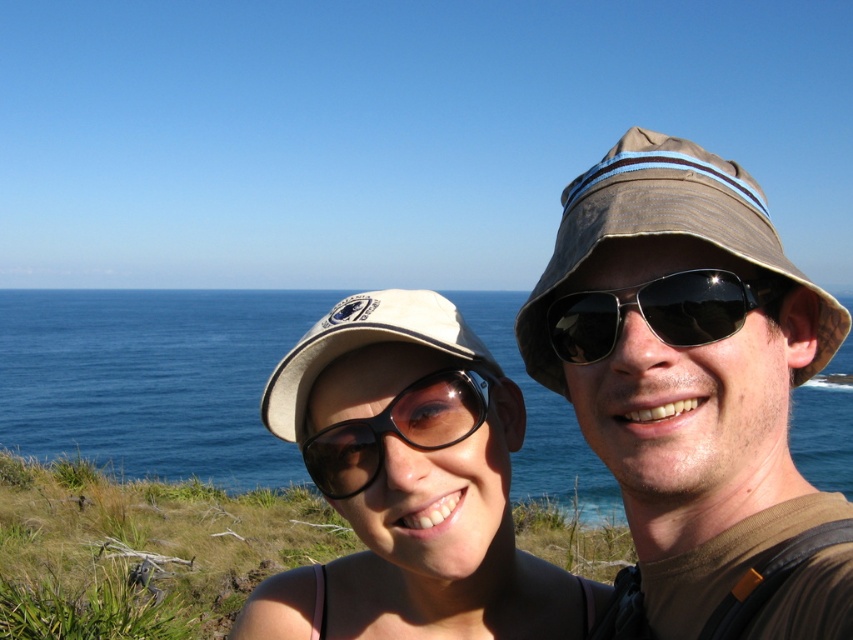
Between matte beige cap at center and blue water at center, which one appears on the right side from the viewer's perspective?

matte beige cap at center

Based on the photo, is matte beige cap at center bigger than blue water at center?

Incorrect, matte beige cap at center is not larger than blue water at center.

Image resolution: width=853 pixels, height=640 pixels. I want to click on matte beige cap at center, so click(x=409, y=484).

Is white fabric baseball cap at upper center smaller than black matte sunglasses at center?

No, white fabric baseball cap at upper center is not smaller than black matte sunglasses at center.

Where is `white fabric baseball cap at upper center`? white fabric baseball cap at upper center is located at coordinates (364, 346).

Between point (437, 344) and point (456, 372), which one is positioned in front?

Point (437, 344)

Locate an element on the screen. The image size is (853, 640). white fabric baseball cap at upper center is located at coordinates (364, 346).

Does blue water at center have a greater height compared to black matte sunglasses at center?

Correct, blue water at center is much taller as black matte sunglasses at center.

Consider the image. Is blue water at center smaller than black matte sunglasses at center?

No.

The width and height of the screenshot is (853, 640). In order to click on blue water at center in this screenshot , I will do `click(151, 378)`.